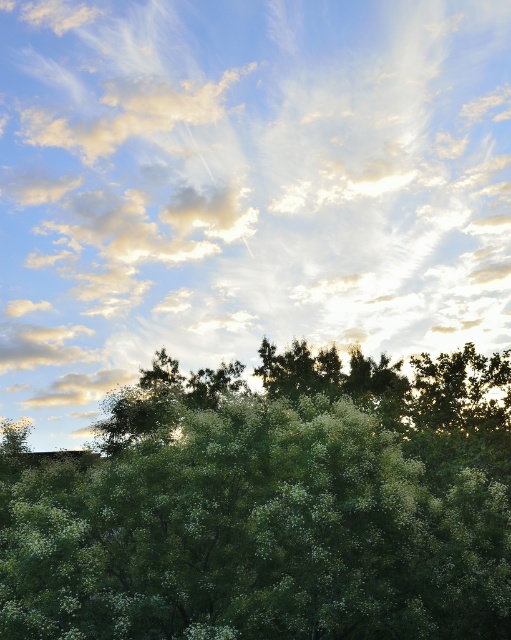
Does white fluffy cloud at upper center appear on the right side of green leafy tree at center?

Incorrect, white fluffy cloud at upper center is not on the right side of green leafy tree at center.

Does white fluffy cloud at upper center lie behind green leafy tree at center?

Yes, white fluffy cloud at upper center is behind green leafy tree at center.

Describe the element at coordinates (244, 186) in the screenshot. I see `white fluffy cloud at upper center` at that location.

You are a GUI agent. You are given a task and a screenshot of the screen. Output one action in this format:
    pyautogui.click(x=<x>, y=<y>)
    Task: Click on the white fluffy cloud at upper center
    This screenshot has width=511, height=640.
    Given the screenshot: What is the action you would take?
    pyautogui.click(x=244, y=186)